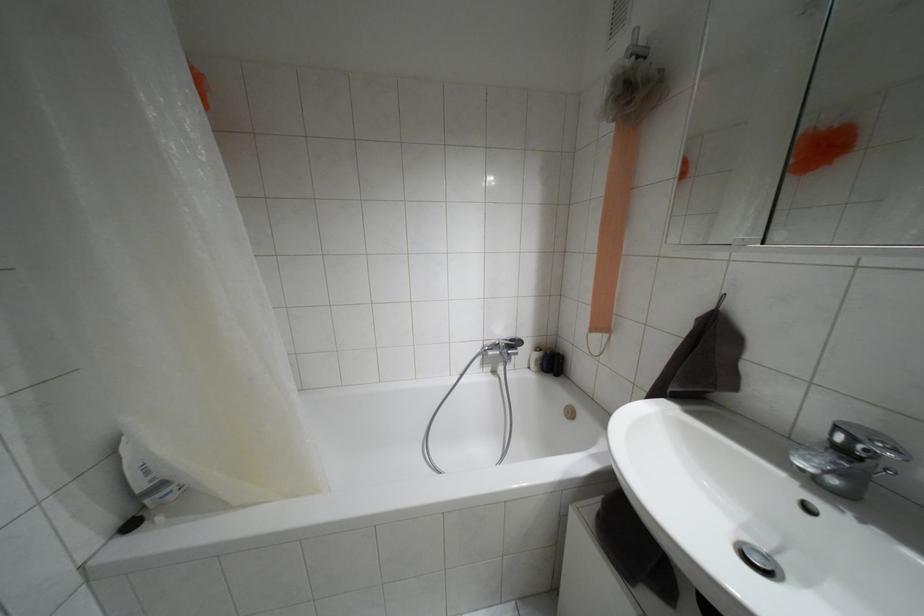
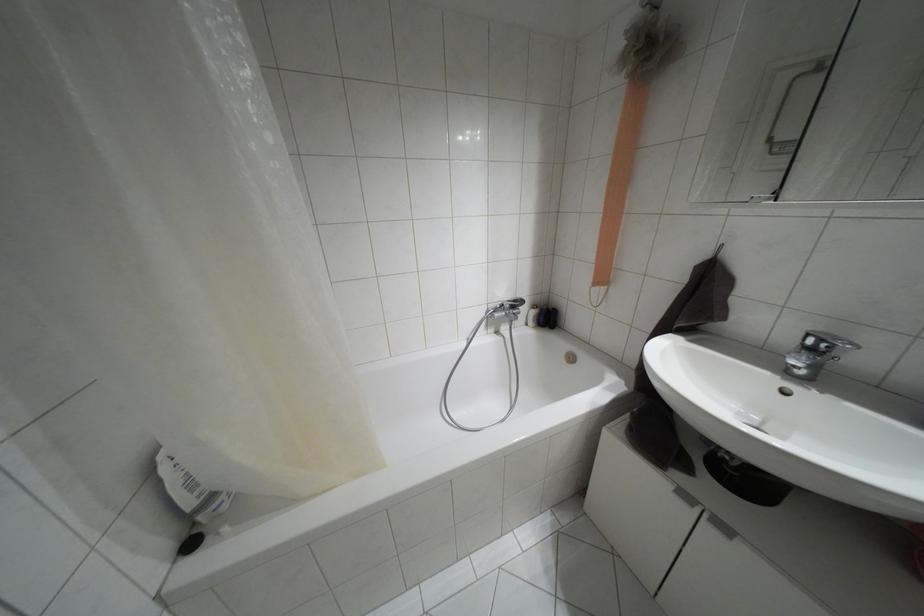
Find the pixel in the second image that matches the point at 162,483 in the first image.

(212, 496)